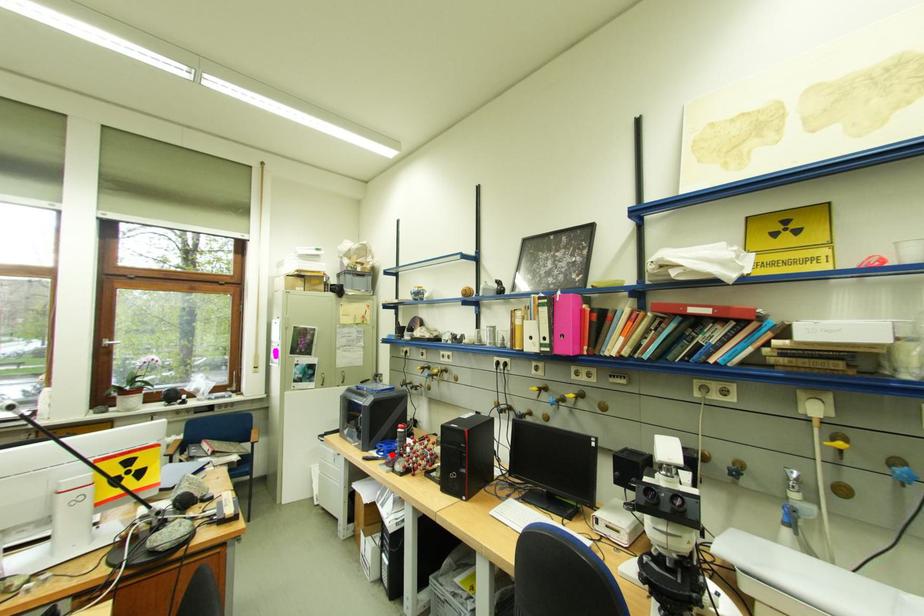
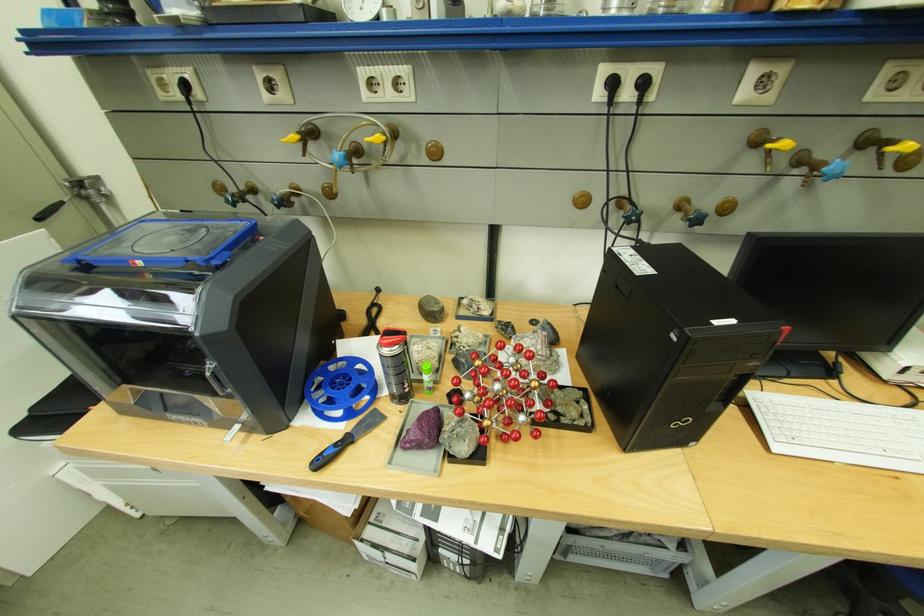
Question: I am providing you with two images of the same scene from different viewpoints. A red point is shown in image1. For the corresponding object point in image2, is it positioned nearer or farther from the camera?

Choices:
 (A) Nearer
 (B) Farther

Answer: (A)